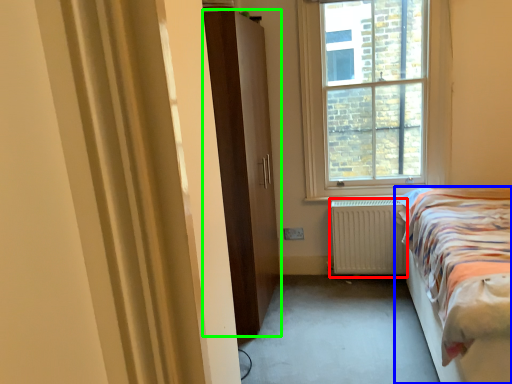
Question: Which object is the closest to the radiator (highlighted by a red box)? Choose among these: bed (highlighted by a blue box) or door (highlighted by a green box).

Choices:
 (A) bed
 (B) door

Answer: (A)